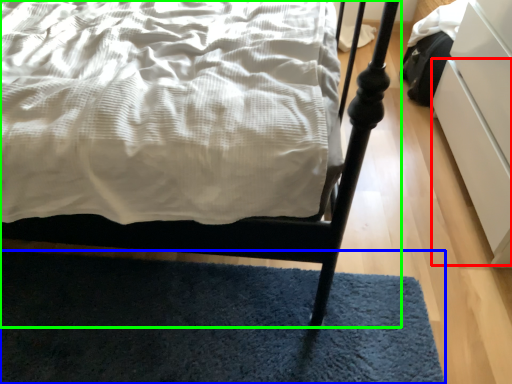
Question: Which object is the closest to the drawer (highlighted by a red box)? Choose among these: mat (highlighted by a blue box) or bed (highlighted by a green box).

Choices:
 (A) mat
 (B) bed

Answer: (A)